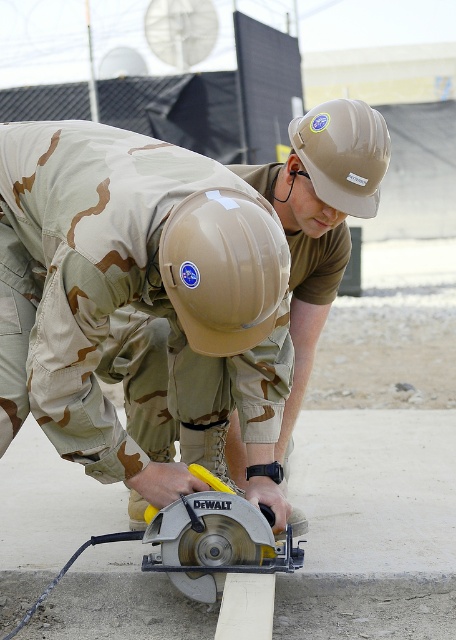
Which is more to the right, tan matte hard hat at center or tan matte hard hat at upper center?

tan matte hard hat at upper center

Is point (171, 248) less distant than point (379, 161)?

Yes, point (171, 248) is in front of point (379, 161).

Is point (179, 205) positioned before point (338, 156)?

That is True.

Find the location of a particular element. The height and width of the screenshot is (640, 456). tan matte hard hat at center is located at coordinates (223, 269).

Who is more distant from viewer, [310,264] or [217,252]?

Point [310,264]

Can you confirm if matte khaki helmet at center is thinner than tan matte hard hat at center?

No, matte khaki helmet at center is not thinner than tan matte hard hat at center.

The image size is (456, 640). I want to click on matte khaki helmet at center, so click(166, 285).

Between matte khaki helmet at center and yellow plastic circular saw at center, which one is positioned lower?

yellow plastic circular saw at center is below.

Which is more to the right, matte khaki helmet at center or yellow plastic circular saw at center?

Positioned to the right is matte khaki helmet at center.

This screenshot has height=640, width=456. I want to click on matte khaki helmet at center, so click(166, 285).